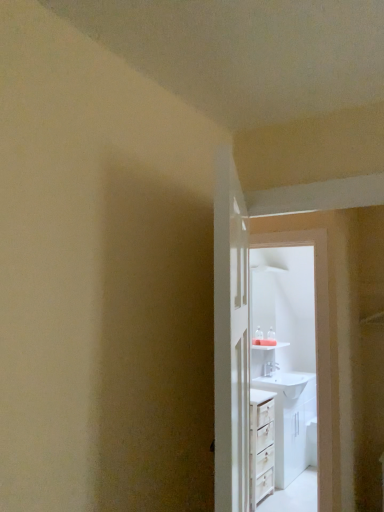
Question: Is white glossy sink at upper center spatially inside white glossy door at center, or outside of it?

Choices:
 (A) inside
 (B) outside

Answer: (B)

Question: Looking at their shapes, would you say white glossy sink at upper center is wider or thinner than white glossy door at center?

Choices:
 (A) wide
 (B) thin

Answer: (B)

Question: Estimate the real-world distances between objects in this image. Which object is farther from the white glossy door at center?

Choices:
 (A) white glossy sink at upper center
 (B) white glossy sink at center

Answer: (B)

Question: Estimate the real-world distances between objects in this image. Which object is closer to the white glossy sink at upper center?

Choices:
 (A) white glossy sink at center
 (B) white glossy door at center

Answer: (B)